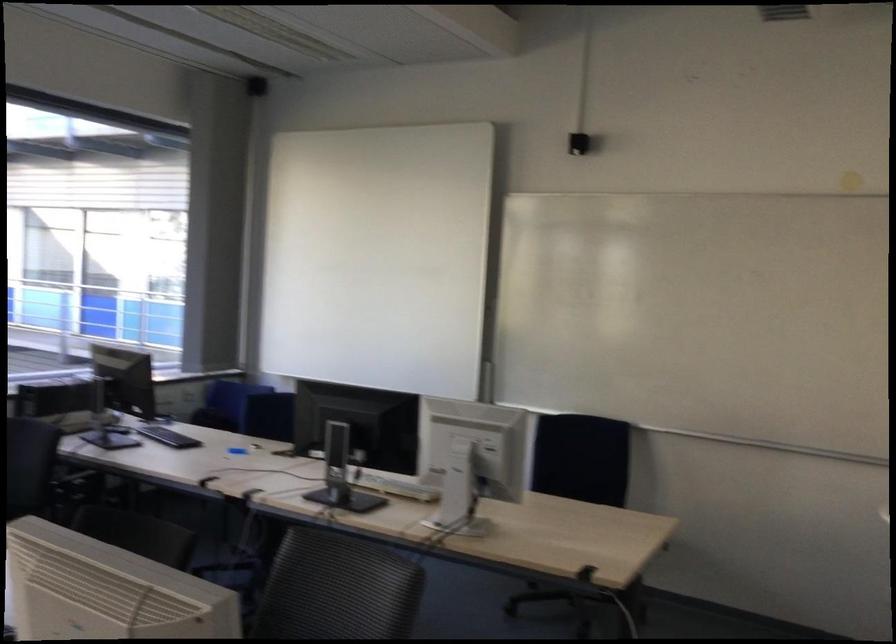
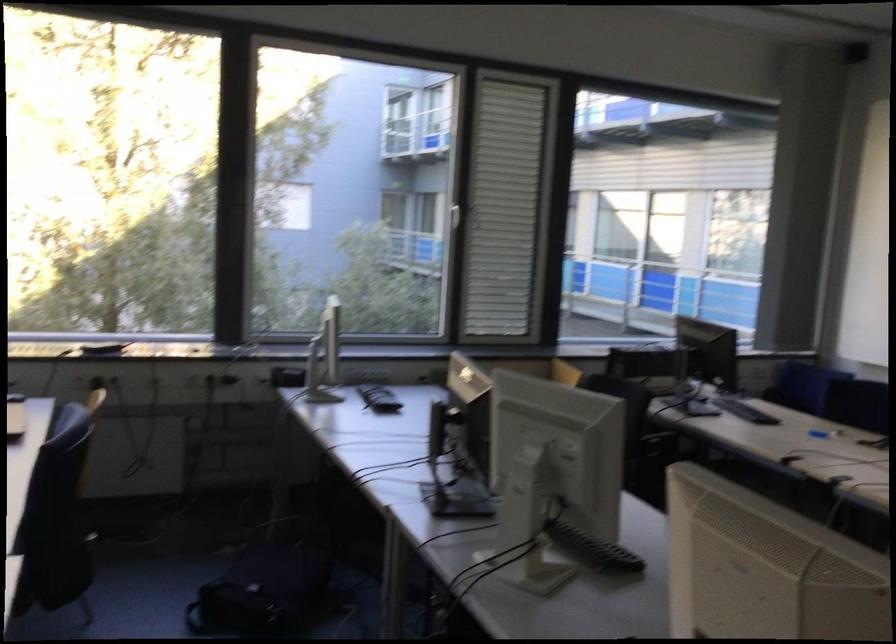
Question: The images are taken continuously from a first-person perspective. In which direction is your viewpoint rotating?

Choices:
 (A) Left
 (B) Right
 (C) Up
 (D) Down

Answer: (A)